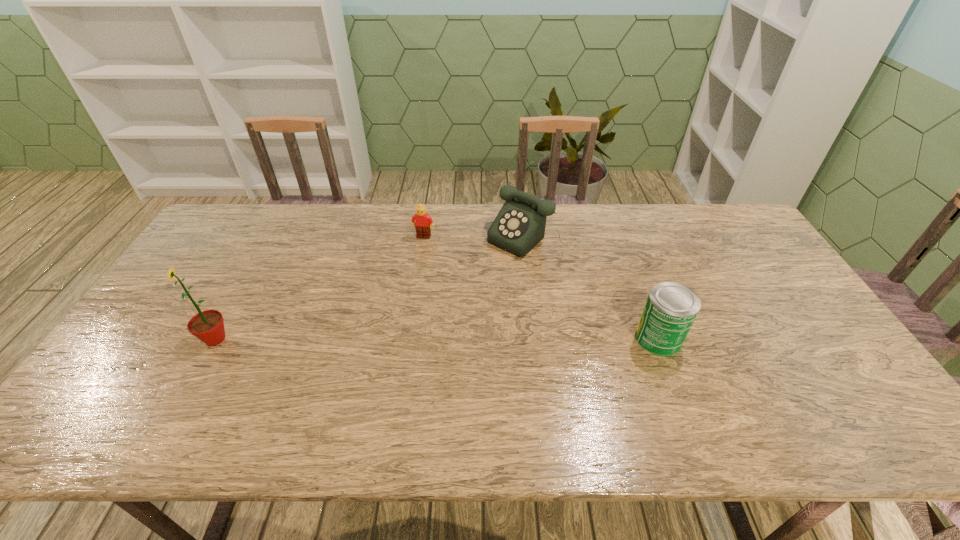
Locate an element on the screen. The width and height of the screenshot is (960, 540). vacant space on the desktop that is between the sunflower and the rightmost object and is positioned on the dial of the second object from right to left is located at coordinates (425, 339).

I want to click on vacant space on the desktop that is between the leftmost object and the can and is positioned on the face of the shortest object, so click(x=394, y=339).